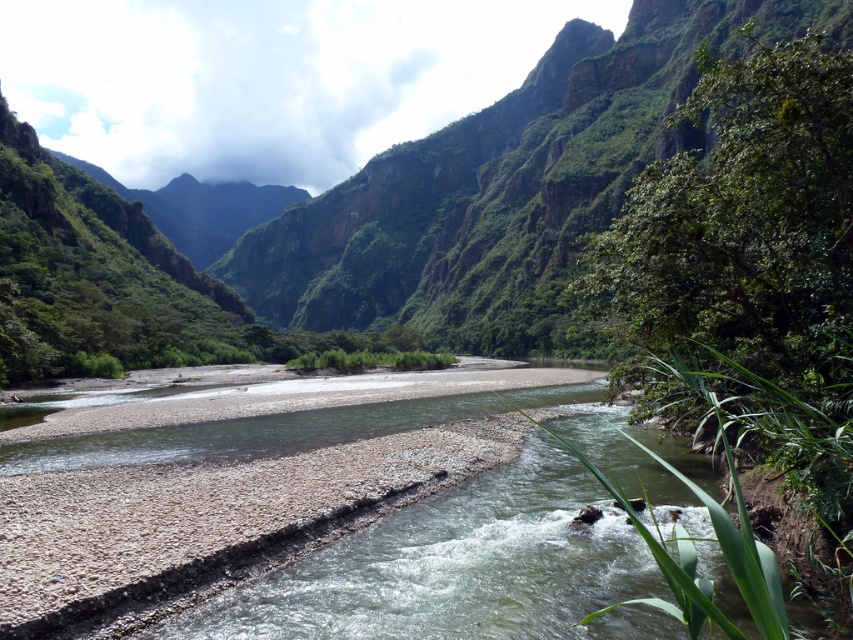
You are standing at the center of the valley and see a point marked at coordinates (747, 285). What object is located at that point?

The point at coordinates (747, 285) indicates a green leafy tree at the right.

You are planning to set up a campsite in the valley. You want to choose a spot that is wider than the green leafy tree at right but narrower than the green rocky mountain at center. Is there a suitable location available based on the scene?

The green leafy tree at right is narrower than the green rocky mountain at center. Therefore, there is a suitable location between their widths for setting up the campsite.